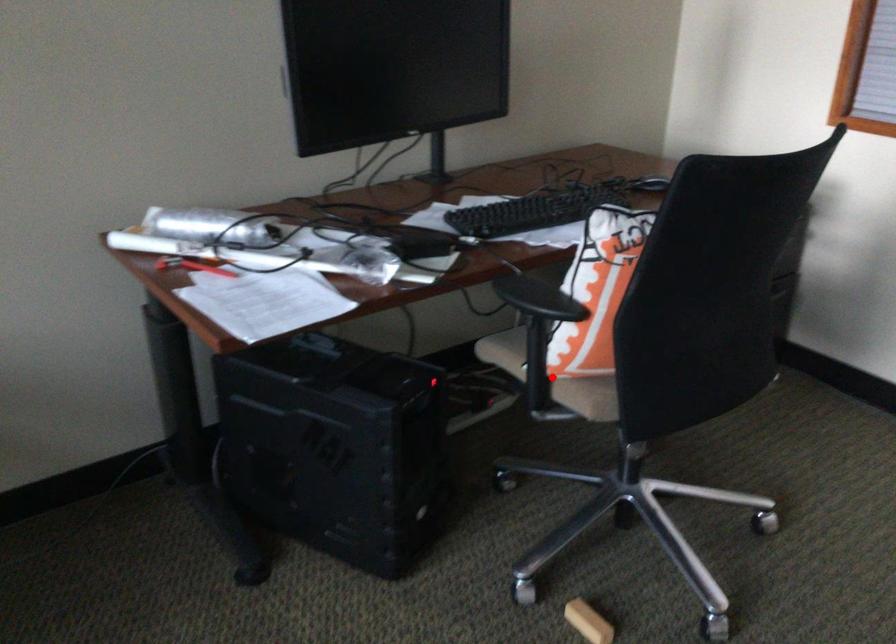
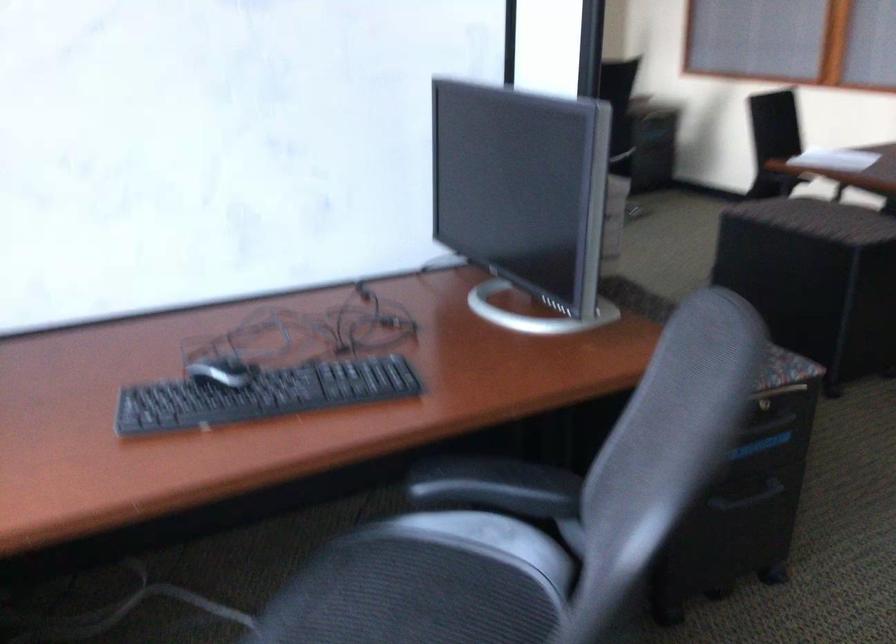
Question: I am providing you with two images of the same scene from different viewpoints. A red point is marked on the first image. Can you still see the location of the red point in image 2?

Choices:
 (A) Yes
 (B) No

Answer: (B)